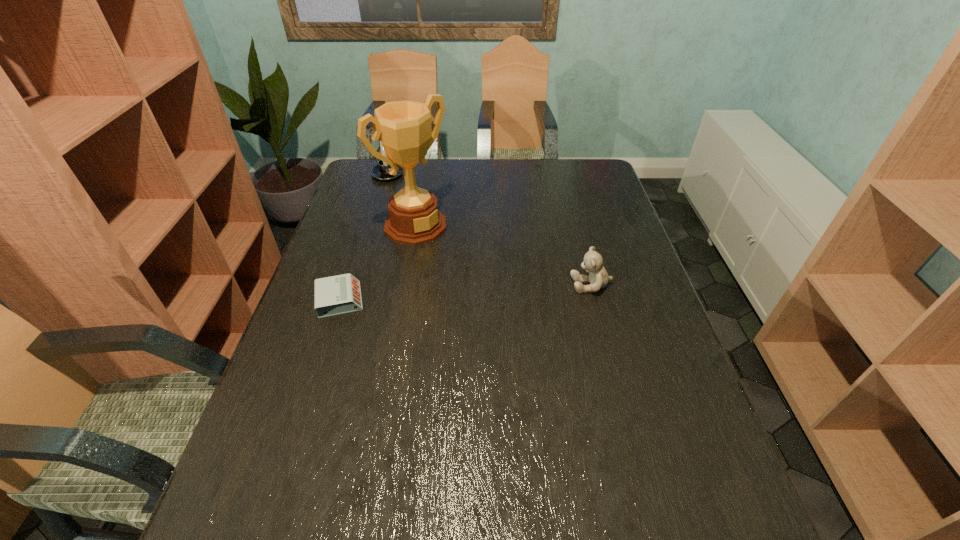
Where is `free space that satisfies the following two spatial constraints: 1. on the front side of the third shortest object; 2. on the left side of the second farthest object`? The height and width of the screenshot is (540, 960). free space that satisfies the following two spatial constraints: 1. on the front side of the third shortest object; 2. on the left side of the second farthest object is located at coordinates (372, 226).

Where is `vacant space that satisfies the following two spatial constraints: 1. on the back side of the second shortest object; 2. on the face of the alarm clock`? The image size is (960, 540). vacant space that satisfies the following two spatial constraints: 1. on the back side of the second shortest object; 2. on the face of the alarm clock is located at coordinates (345, 285).

What are the coordinates of `free location that satisfies the following two spatial constraints: 1. on the back side of the shortest object; 2. on the face of the third tallest object` in the screenshot? It's located at (345, 285).